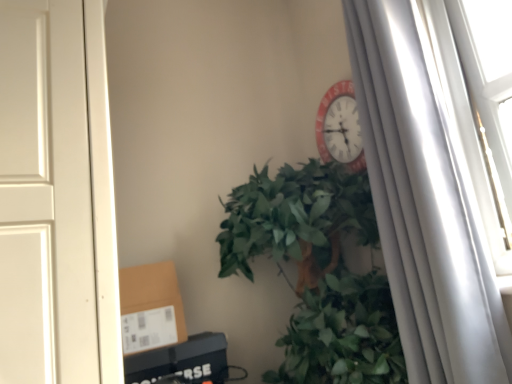
Question: Looking at their shapes, would you say brown cardboard box at lower left is wider or thinner than green leafy plant at center?

Choices:
 (A) wide
 (B) thin

Answer: (B)

Question: Does point (159, 339) appear closer or farther from the camera than point (310, 213)?

Choices:
 (A) closer
 (B) farther

Answer: (B)

Question: Considering the real-world distances, which object is closest to the green leafy plant at center?

Choices:
 (A) white matte curtain at right
 (B) brown cardboard box at lower left

Answer: (A)

Question: Estimate the real-world distances between objects in this image. Which object is farther from the brown cardboard box at lower left?

Choices:
 (A) green leafy plant at center
 (B) white matte curtain at right

Answer: (B)